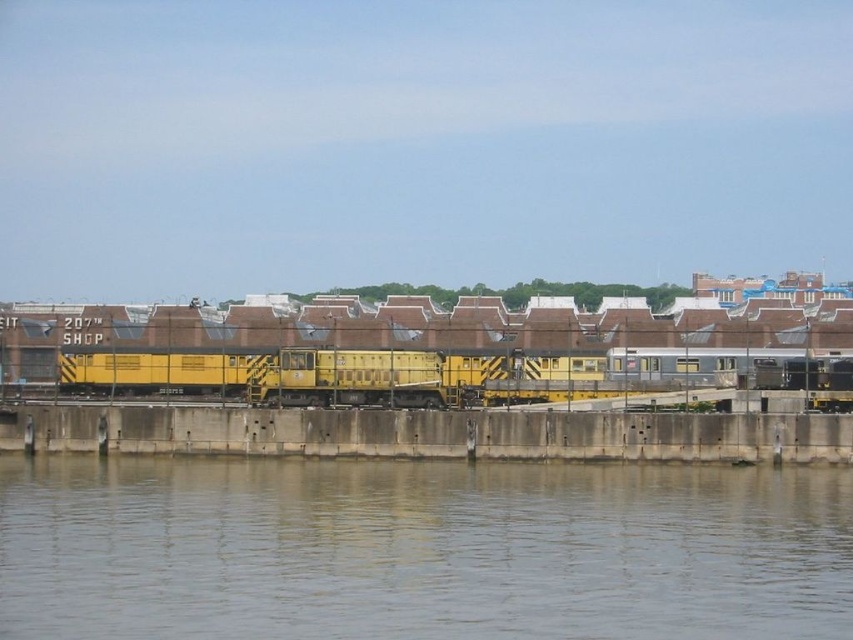
Question: Can you confirm if concrete at center is smaller than yellow matte train at center?

Choices:
 (A) no
 (B) yes

Answer: (B)

Question: Which object appears closest to the camera in this image?

Choices:
 (A) gray smooth water at lower center
 (B) yellow matte train at center

Answer: (A)

Question: Does gray smooth water at lower center have a greater width compared to concrete at center?

Choices:
 (A) no
 (B) yes

Answer: (A)

Question: Which object appears closest to the camera in this image?

Choices:
 (A) yellow matte train at center
 (B) concrete at center
 (C) gray smooth water at lower center

Answer: (C)

Question: Estimate the real-world distances between objects in this image. Which object is farther from the concrete at center?

Choices:
 (A) gray smooth water at lower center
 (B) yellow matte train at center

Answer: (A)

Question: From the image, what is the correct spatial relationship of concrete at center in relation to yellow matte train at center?

Choices:
 (A) below
 (B) above

Answer: (A)